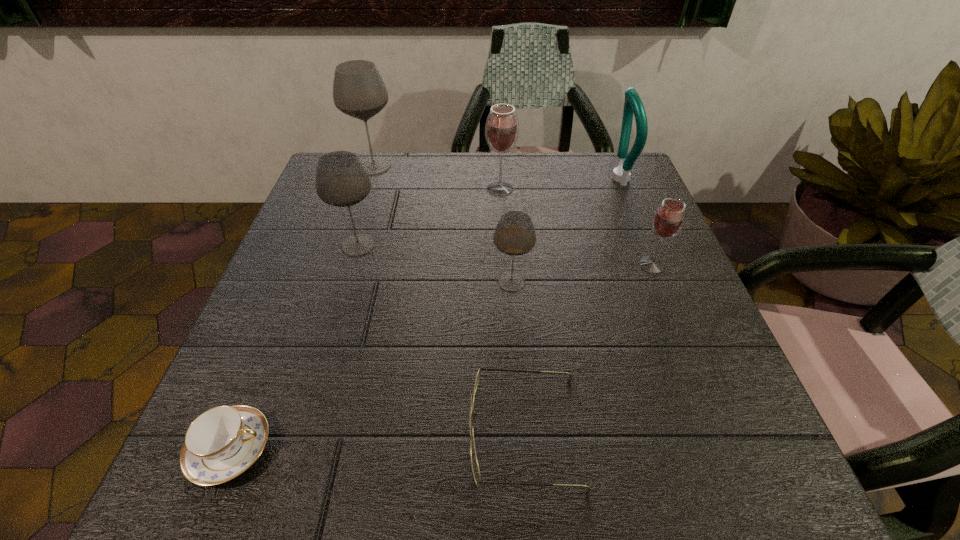
You are a GUI agent. You are given a task and a screenshot of the screen. Output one action in this format:
    pyautogui.click(x=<x>, y=<y>)
    Task: Click on the wineglass that is the third closest to the smallest gray wineglass
    The width and height of the screenshot is (960, 540).
    Given the screenshot: What is the action you would take?
    pyautogui.click(x=502, y=126)

Identify which wineglass is the fifth closest to the green bottle opener. Please provide its 2D coordinates. Your answer should be formatted as a tuple, i.e. [(x, y)], where the tuple contains the x and y coordinates of a point satisfying the conditions above.

[(341, 180)]

Locate an element on the screen. The image size is (960, 540). gray wineglass that is the second closest one to the smallest gray wineglass is located at coordinates (359, 91).

Identify the location of gray wineglass that is the closest to the left red wineglass. pos(359,91).

Identify the location of vacant space that satisfies the following two spatial constraints: 1. on the front side of the tallest wineglass; 2. on the left side of the second biggest gray wineglass. (348, 245).

I want to click on free space that satisfies the following two spatial constraints: 1. on the front side of the farther red wineglass; 2. on the right side of the nearest gray wineglass, so click(x=505, y=282).